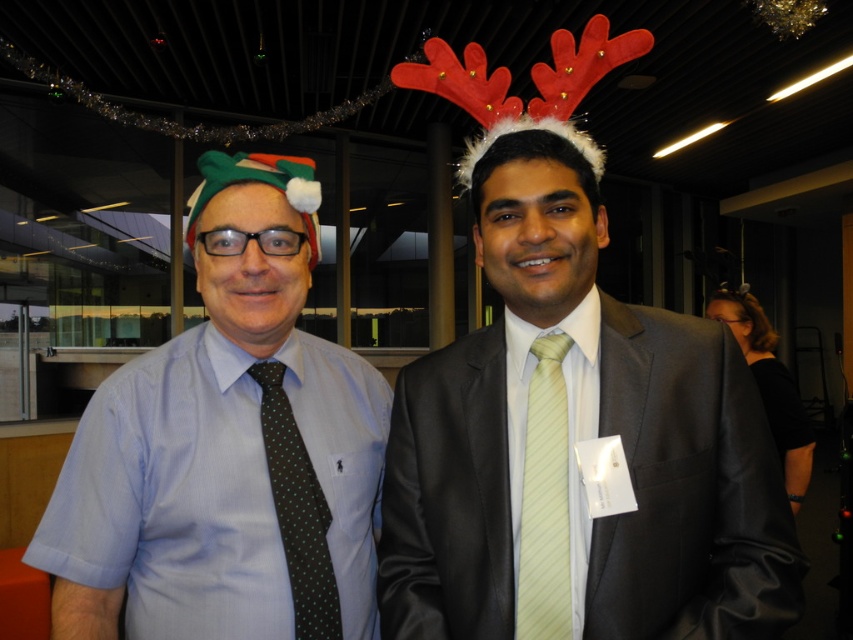
Question: Where is matte green tie at left located in relation to dark green dotted tie at left in the image?

Choices:
 (A) left
 (B) right

Answer: (A)

Question: Can you confirm if matte black suit at center is positioned below matte green tie at left?

Choices:
 (A) no
 (B) yes

Answer: (B)

Question: Does light yellow striped tie at center appear under dark green dotted tie at left?

Choices:
 (A) yes
 (B) no

Answer: (B)

Question: Estimate the real-world distances between objects in this image. Which object is farther from the dark green dotted tie at left?

Choices:
 (A) light yellow striped tie at center
 (B) matte green tie at left
 (C) matte black suit at center

Answer: (C)

Question: Which of the following is the closest to the observer?

Choices:
 (A) matte black suit at center
 (B) matte green tie at left
 (C) light yellow striped tie at center

Answer: (A)

Question: Which point is closer to the camera taking this photo?

Choices:
 (A) (294, 449)
 (B) (73, 477)
 (C) (451, 401)
 (D) (523, 538)

Answer: (D)